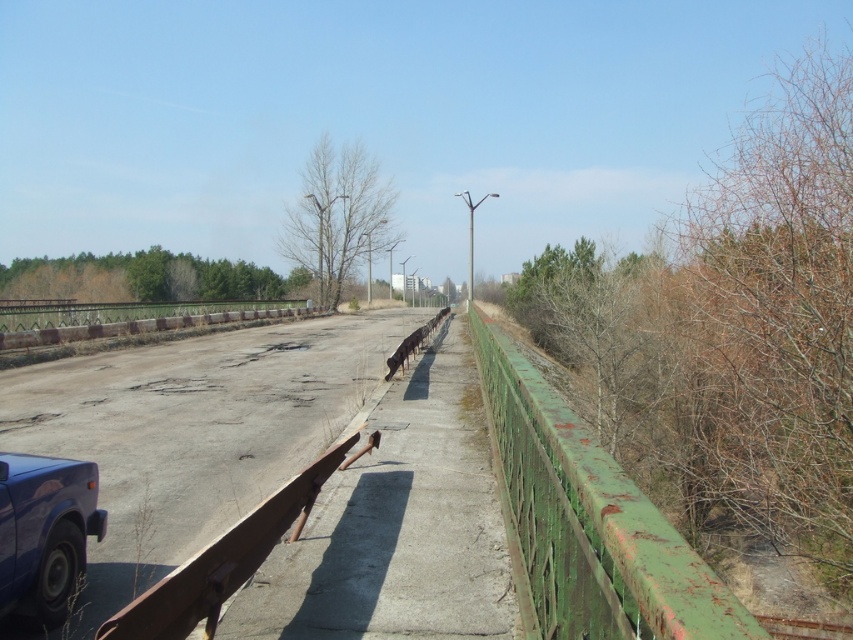
Question: Does rusty green fence at right come behind matte blue car at lower left?

Choices:
 (A) yes
 (B) no

Answer: (B)

Question: Considering the relative positions of rusty green fence at right and matte blue car at lower left in the image provided, where is rusty green fence at right located with respect to matte blue car at lower left?

Choices:
 (A) below
 (B) above

Answer: (B)

Question: Which point appears closest to the camera in this image?

Choices:
 (A) click(x=6, y=508)
 (B) click(x=614, y=557)

Answer: (B)

Question: Is rusty green fence at right to the right of matte blue car at lower left from the viewer's perspective?

Choices:
 (A) no
 (B) yes

Answer: (B)